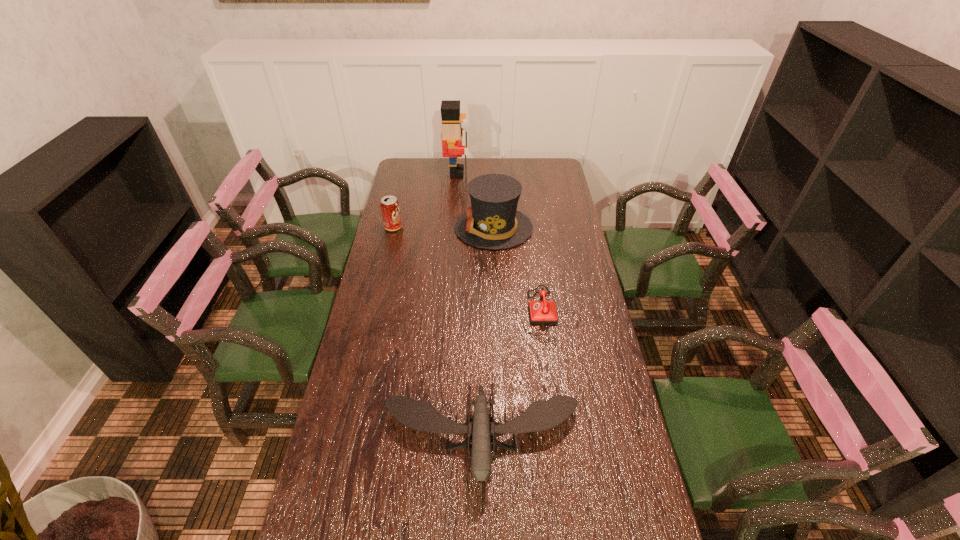
I want to click on free region located with goggles on the front of the second tallest object, so click(436, 228).

Find the location of a particular element. The height and width of the screenshot is (540, 960). vacant space located with goggles on the front of the second tallest object is located at coordinates (402, 228).

Find the location of a particular element. Image resolution: width=960 pixels, height=540 pixels. vacant area situated with goggles on the front of the second tallest object is located at coordinates (439, 228).

I want to click on vacant space located on the right of the leftmost object, so click(487, 227).

Identify the location of vacant space situated at the head of the nearest object. The height and width of the screenshot is (540, 960). (481, 539).

Find the location of a particular element. vacant area situated 0.400m on the dial of the shortest object is located at coordinates (415, 314).

Where is `free space located 0.120m on the dial of the shortest object`? Image resolution: width=960 pixels, height=540 pixels. free space located 0.120m on the dial of the shortest object is located at coordinates (492, 314).

I want to click on free spot located 0.090m on the dial of the shortest object, so click(501, 314).

Find the location of a particular element. This screenshot has height=540, width=960. object present at the far edge is located at coordinates (452, 133).

Where is `soda can situated at the left edge`? The height and width of the screenshot is (540, 960). soda can situated at the left edge is located at coordinates (390, 209).